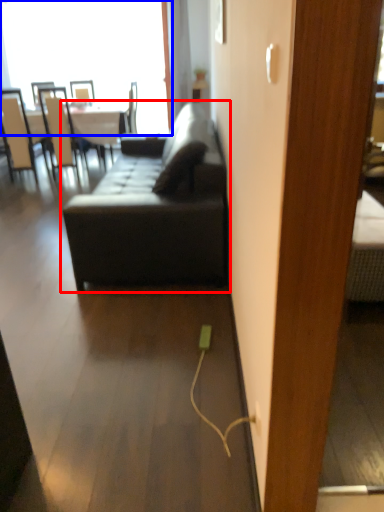
Question: Which of the following is the closest to the observer, studio couch (highlighted by a red box) or window (highlighted by a blue box)?

Choices:
 (A) studio couch
 (B) window

Answer: (A)